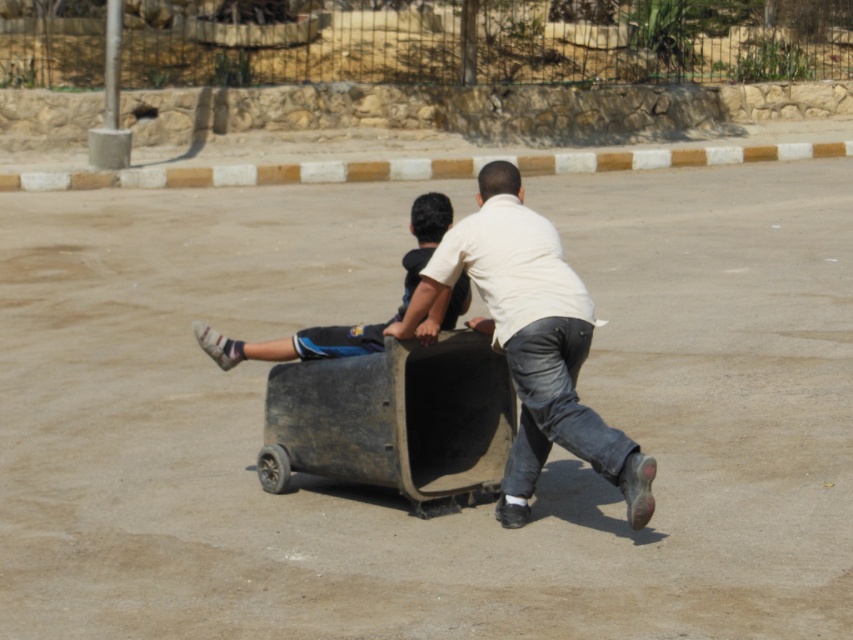
From the picture: You are trying to determine which object is bigger between the rusty metal wagon at center and the white matte shirt at center. Based on the scene, which one is larger?

The rusty metal wagon at center has a smaller size compared to white matte shirt at center, so the white matte shirt at center is larger.

You are standing at the camera position and want to walk towards the point marked at coordinates (486, 406). How far will you have to walk to reach that point?

The point marked at coordinates (486, 406) is 8.83 meters away from the camera, so you will have to walk 8.83 meters to reach it.